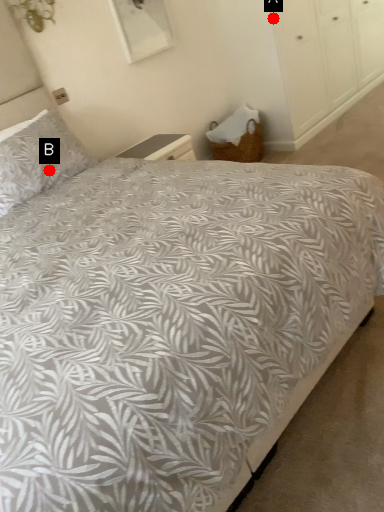
Question: Two points are circled on the image, labeled by A and B beside each circle. Which point appears closest to the camera in this image?

Choices:
 (A) A is closer
 (B) B is closer

Answer: (B)